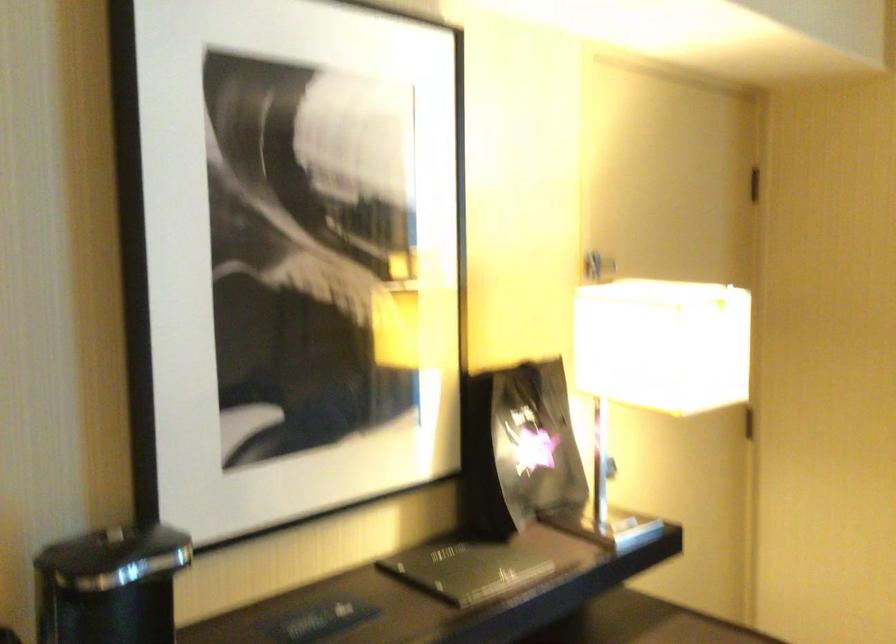
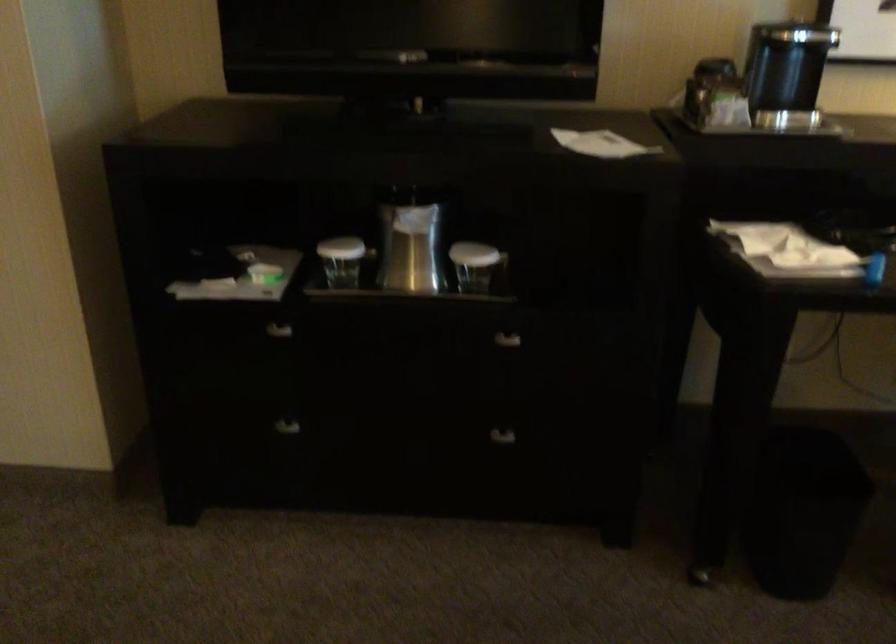
First-person continuous shooting, in which direction is the camera rotating?

The camera's rotation is toward left-down.